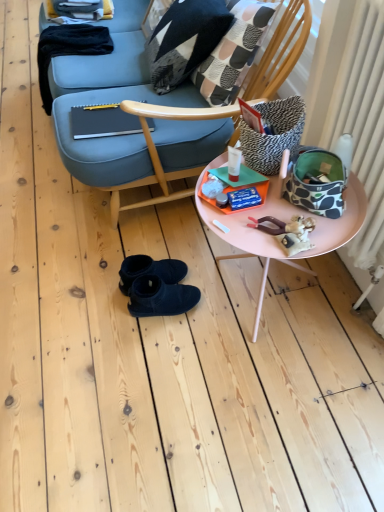
Image resolution: width=384 pixels, height=512 pixels. Find the location of `free spot above pink plastic table at center (from a real-world perspective)`. free spot above pink plastic table at center (from a real-world perspective) is located at coordinates (283, 187).